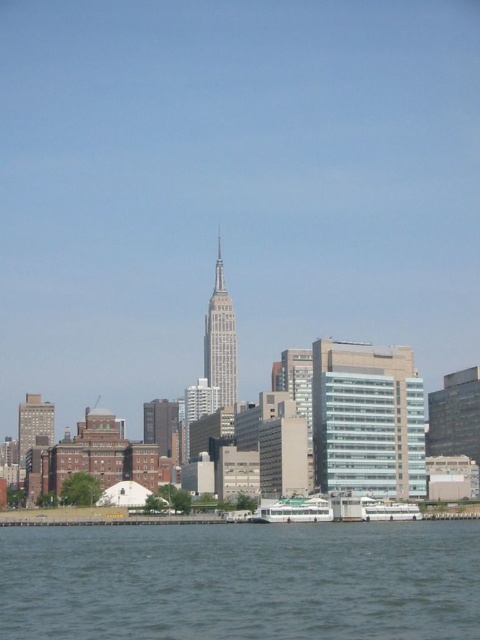
Is clear water at lower left closer to camera compared to brick textured building at left?

Yes, it is in front of brick textured building at left.

Does clear water at lower left appear under brick textured building at left?

Actually, clear water at lower left is above brick textured building at left.

The image size is (480, 640). I want to click on clear water at lower left, so click(x=241, y=580).

Can you confirm if brick textured building at left is bigger than white glossy boat at lower center?

Indeed, brick textured building at left has a larger size compared to white glossy boat at lower center.

Who is higher up, brick textured building at left or white glossy boat at lower center?

Positioned higher is white glossy boat at lower center.

Between point (31, 401) and point (298, 518), which one is positioned behind?

Point (31, 401)

I want to click on brick textured building at left, so click(x=34, y=424).

Does clear water at lower left appear over gray glass tower at center?

Actually, clear water at lower left is below gray glass tower at center.

Does clear water at lower left come behind gray glass tower at center?

No.

At what (x,y) coordinates should I click in order to perform the action: click on clear water at lower left. Please return your answer as a coordinate pair (x, y). The image size is (480, 640). Looking at the image, I should click on (241, 580).

Image resolution: width=480 pixels, height=640 pixels. I want to click on clear water at lower left, so click(241, 580).